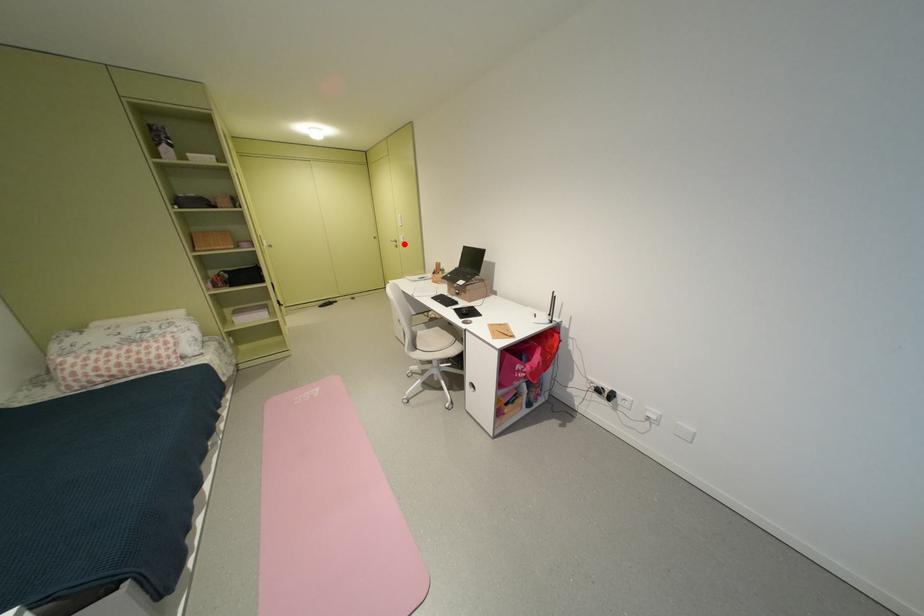
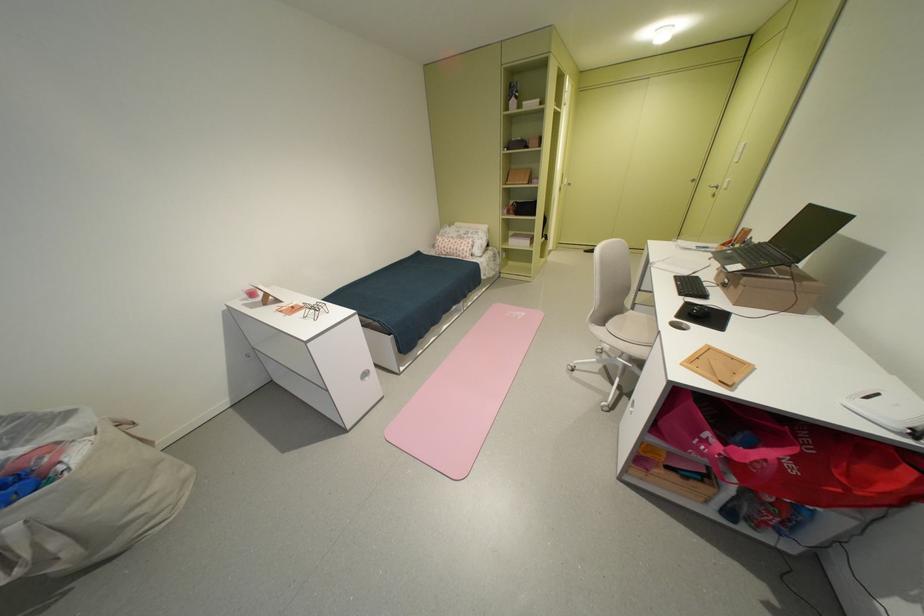
Find the pixel in the second image that matches the highlighted location in the first image.

(724, 190)